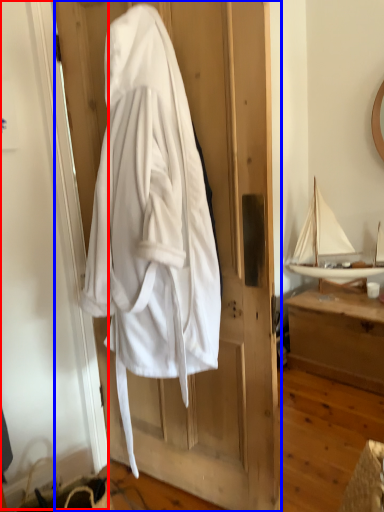
Question: Among these objects, which one is nearest to the camera, screen door (highlighted by a red box) or door (highlighted by a blue box)?

Choices:
 (A) screen door
 (B) door

Answer: (A)